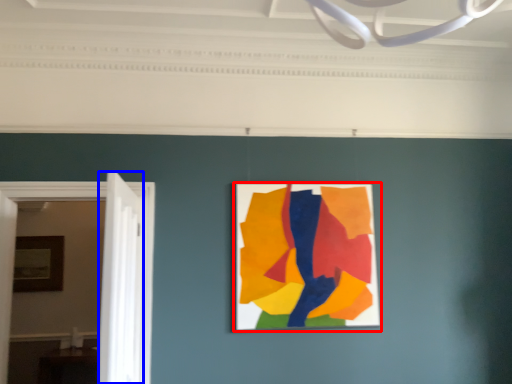
Question: Which object appears farthest to the camera in this image, picture frame (highlighted by a red box) or door (highlighted by a blue box)?

Choices:
 (A) picture frame
 (B) door

Answer: (A)